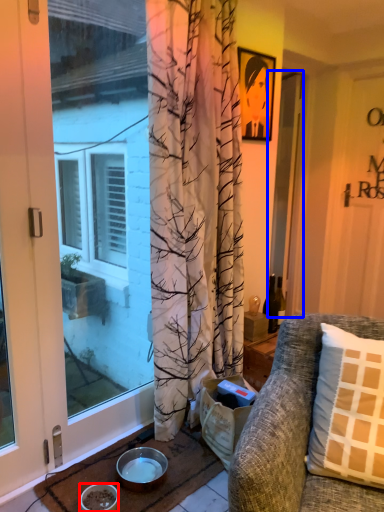
Question: Which of the following is the closest to the observer, bowl (highlighted by a red box) or screen door (highlighted by a blue box)?

Choices:
 (A) bowl
 (B) screen door

Answer: (A)